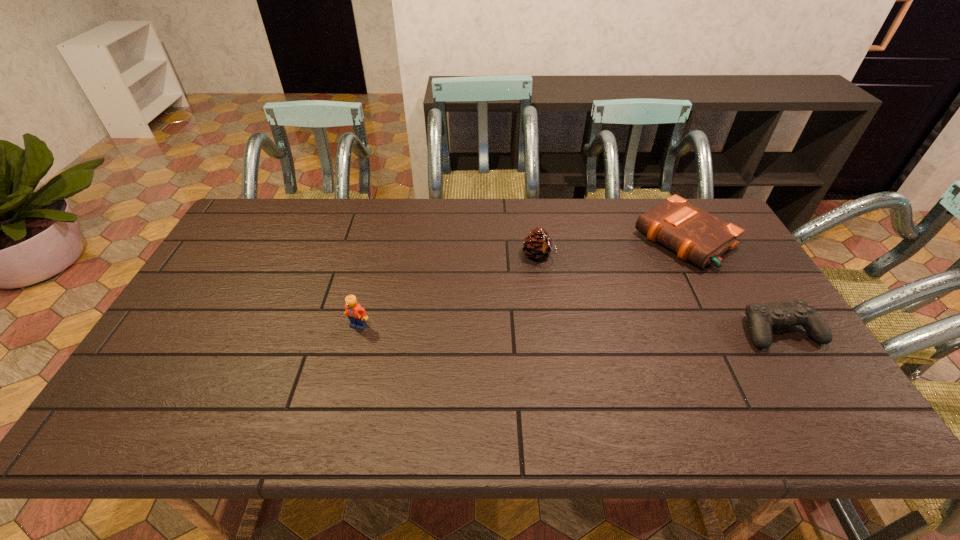
Identify the location of vacant space at the far left corner of the desktop. (264, 208).

Where is `vacant space at the near left corner`? Image resolution: width=960 pixels, height=540 pixels. vacant space at the near left corner is located at coordinates (146, 391).

This screenshot has height=540, width=960. Find the location of `vacant space that's between the Bible and the third object from right to left`. vacant space that's between the Bible and the third object from right to left is located at coordinates (611, 247).

In order to click on unoccupied area between the Bible and the leftmost object in this screenshot , I will do `click(521, 282)`.

Where is `empty space that is in between the Bible and the control`? empty space that is in between the Bible and the control is located at coordinates (732, 285).

What are the coordinates of `unoccupied area between the third object from right to left and the control` in the screenshot? It's located at (660, 293).

Image resolution: width=960 pixels, height=540 pixels. In order to click on vacant space in between the Bible and the control in this screenshot , I will do `click(732, 285)`.

Identify the location of vacant point located between the Bible and the control. (732, 285).

This screenshot has width=960, height=540. Identify the location of vacant space that is in between the third object from right to left and the Bible. (611, 247).

Identify the location of vacant space that is in between the Lego and the control. This screenshot has height=540, width=960. (569, 328).